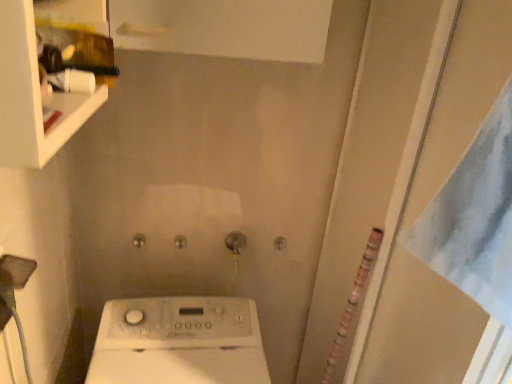
Question: Is transparent plastic screen door at right at the back of white glossy shelf at upper left?

Choices:
 (A) no
 (B) yes

Answer: (A)

Question: From the image's perspective, does white glossy shelf at upper left appear higher than transparent plastic screen door at right?

Choices:
 (A) no
 (B) yes

Answer: (B)

Question: Does white glossy shelf at upper left appear on the left side of transparent plastic screen door at right?

Choices:
 (A) no
 (B) yes

Answer: (B)

Question: From a real-world perspective, is white glossy shelf at upper left positioned over transparent plastic screen door at right based on gravity?

Choices:
 (A) yes
 (B) no

Answer: (A)

Question: Does white glossy shelf at upper left appear on the right side of transparent plastic screen door at right?

Choices:
 (A) yes
 (B) no

Answer: (B)

Question: From the image's perspective, does white glossy shelf at upper left appear lower than transparent plastic screen door at right?

Choices:
 (A) yes
 (B) no

Answer: (B)

Question: Is transparent plastic screen door at right at the right side of white glossy shelf at upper left?

Choices:
 (A) yes
 (B) no

Answer: (A)

Question: From a real-world perspective, is transparent plastic screen door at right physically above white glossy shelf at upper left?

Choices:
 (A) yes
 (B) no

Answer: (B)

Question: Can you confirm if transparent plastic screen door at right is wider than white glossy shelf at upper left?

Choices:
 (A) yes
 (B) no

Answer: (B)

Question: From the image's perspective, does transparent plastic screen door at right appear higher than white glossy shelf at upper left?

Choices:
 (A) no
 (B) yes

Answer: (A)

Question: Is transparent plastic screen door at right facing away from white glossy shelf at upper left?

Choices:
 (A) no
 (B) yes

Answer: (A)

Question: Is transparent plastic screen door at right to the left of white glossy shelf at upper left from the viewer's perspective?

Choices:
 (A) no
 (B) yes

Answer: (A)

Question: Does point (463, 132) appear closer or farther from the camera than point (28, 19)?

Choices:
 (A) closer
 (B) farther

Answer: (B)